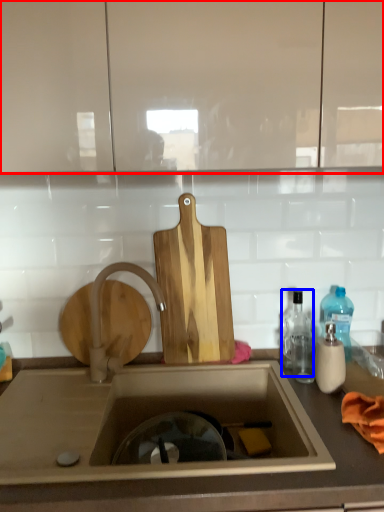
Question: Which object is further to the camera taking this photo, cabinetry (highlighted by a red box) or bottle (highlighted by a blue box)?

Choices:
 (A) cabinetry
 (B) bottle

Answer: (B)